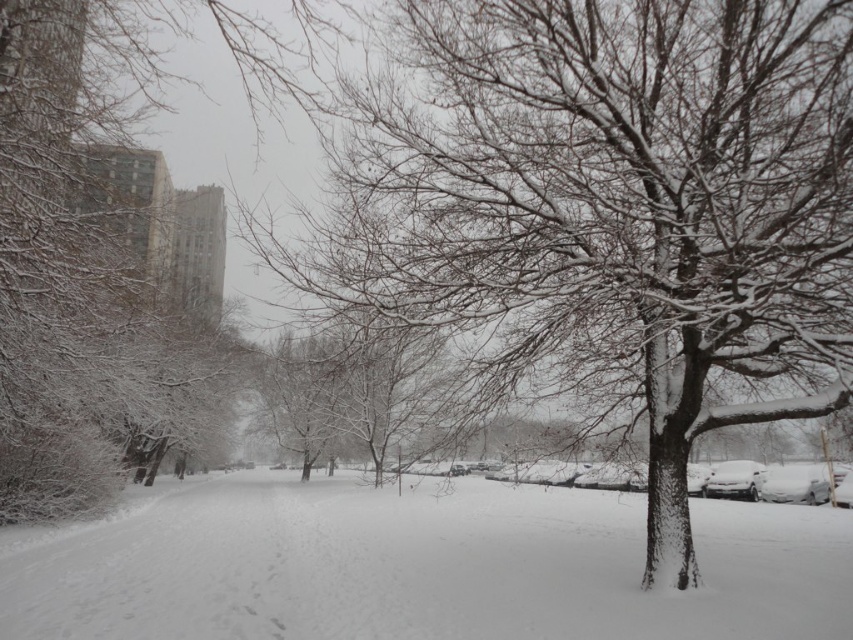
Question: Is white fluffy snow at center in front of snow-covered tree at left?

Choices:
 (A) no
 (B) yes

Answer: (B)

Question: From the image, what is the correct spatial relationship of snow-covered tree at center in relation to white fluffy snow at center?

Choices:
 (A) below
 (B) above

Answer: (B)

Question: Is snow-covered tree at center positioned behind white fluffy snow at center?

Choices:
 (A) yes
 (B) no

Answer: (B)

Question: Which point is farther from the camera taking this photo?

Choices:
 (A) (216, 570)
 (B) (57, 394)
 (C) (816, 100)

Answer: (B)

Question: Which point appears farthest from the camera in this image?

Choices:
 (A) (51, 417)
 (B) (490, 368)

Answer: (A)

Question: Considering the real-world distances, which object is closest to the white fluffy snow at center?

Choices:
 (A) snow-covered tree at left
 (B) snow-covered tree at center

Answer: (A)